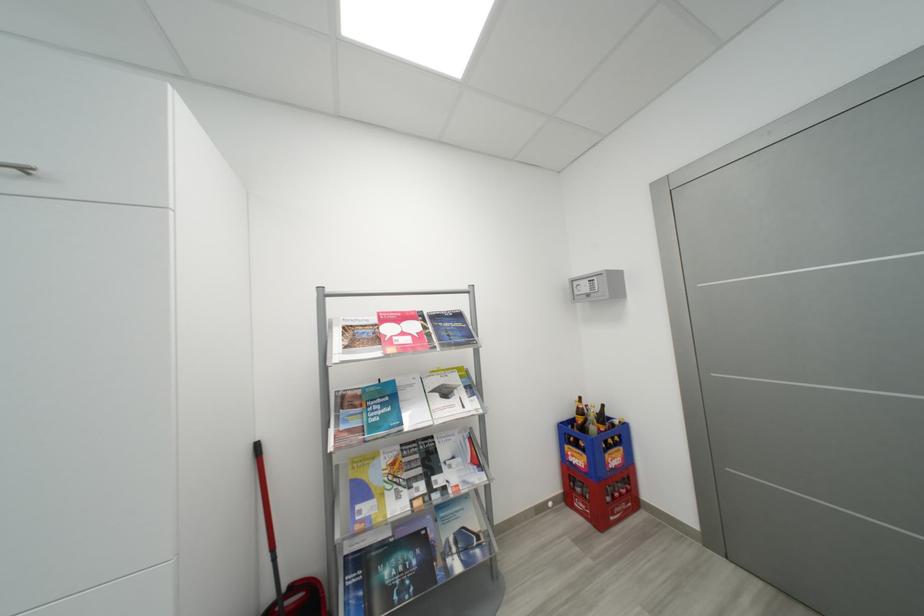
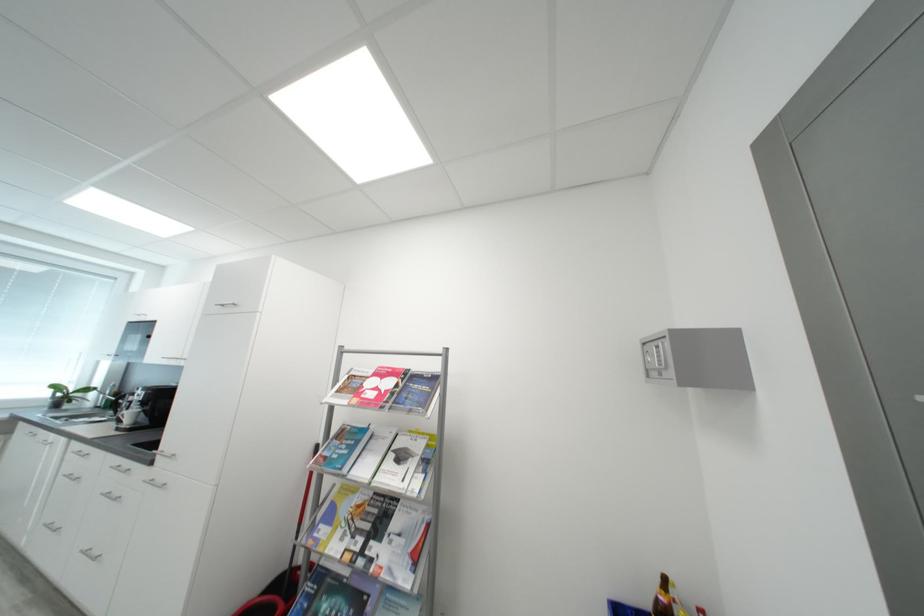
Where in the second image is the point corresponding to (x=445, y=482) from the first image?

(380, 549)